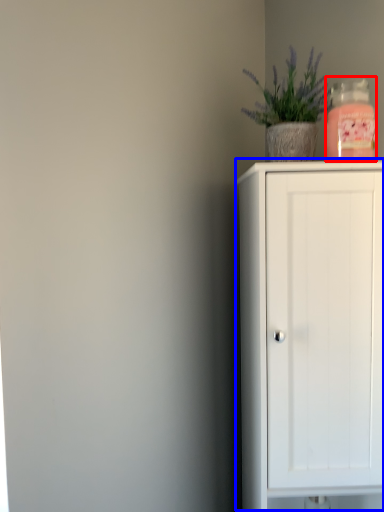
Question: Which object is closer to the camera taking this photo, bottle (highlighted by a red box) or cupboard (highlighted by a blue box)?

Choices:
 (A) bottle
 (B) cupboard

Answer: (B)